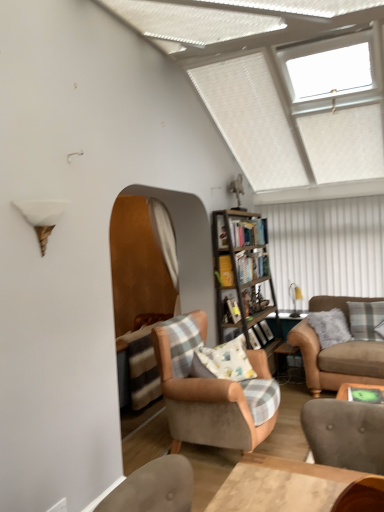
Question: From a real-world perspective, is wooden bookshelf at center on metallic silver side table at lower right?

Choices:
 (A) no
 (B) yes

Answer: (B)

Question: From a real-world perspective, is wooden bookshelf at center under metallic silver side table at lower right?

Choices:
 (A) no
 (B) yes

Answer: (A)

Question: Is wooden bookshelf at center oriented towards metallic silver side table at lower right?

Choices:
 (A) yes
 (B) no

Answer: (B)

Question: Does wooden bookshelf at center come behind metallic silver side table at lower right?

Choices:
 (A) yes
 (B) no

Answer: (B)

Question: Can you confirm if wooden bookshelf at center is wider than metallic silver side table at lower right?

Choices:
 (A) no
 (B) yes

Answer: (A)

Question: In terms of size, does orange fabric curtain at center appear bigger or smaller than white plastic window at upper right?

Choices:
 (A) small
 (B) big

Answer: (A)

Question: From a real-world perspective, is orange fabric curtain at center positioned above or below white plastic window at upper right?

Choices:
 (A) above
 (B) below

Answer: (B)

Question: Is orange fabric curtain at center wider or thinner than white plastic window at upper right?

Choices:
 (A) thin
 (B) wide

Answer: (A)

Question: Would you say orange fabric curtain at center is to the left or to the right of white plastic window at upper right in the picture?

Choices:
 (A) left
 (B) right

Answer: (A)

Question: Relative to fluffy cotton pillow at center, the 1th pillow positioned from the front, is white plastic window at upper right in front or behind?

Choices:
 (A) front
 (B) behind

Answer: (A)

Question: Visually, is white plastic window at upper right positioned to the left or to the right of fluffy cotton pillow at center, which is the second pillow from right to left?

Choices:
 (A) left
 (B) right

Answer: (B)

Question: Considering the positions of white plastic window at upper right and fluffy cotton pillow at center, which is the second pillow from right to left, in the image, is white plastic window at upper right bigger or smaller than fluffy cotton pillow at center, which is the second pillow from right to left,?

Choices:
 (A) small
 (B) big

Answer: (B)

Question: Considering the positions of white plastic window at upper right and fluffy cotton pillow at center, which is the second pillow from right to left, in the image, is white plastic window at upper right taller or shorter than fluffy cotton pillow at center, which is the second pillow from right to left,?

Choices:
 (A) tall
 (B) short

Answer: (A)

Question: Is metallic silver side table at lower right wider or thinner than fluffy cotton pillow at center, the 1th pillow positioned from the front?

Choices:
 (A) wide
 (B) thin

Answer: (B)

Question: Based on their positions, is metallic silver side table at lower right located to the left or right of fluffy cotton pillow at center, the 2th pillow positioned from the back?

Choices:
 (A) right
 (B) left

Answer: (A)